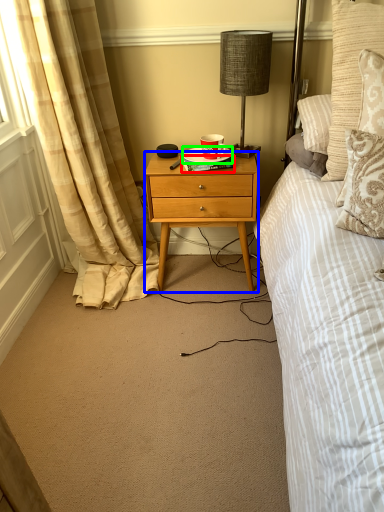
Question: Estimate the real-world distances between objects in this image. Which object is farther from book (highlighted by a red box), desk (highlighted by a blue box) or plate (highlighted by a green box)?

Choices:
 (A) desk
 (B) plate

Answer: (A)